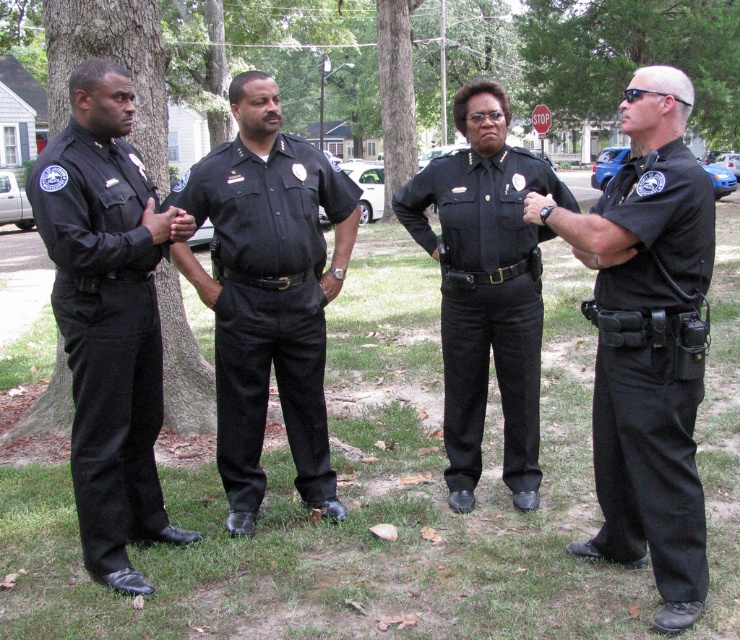
Question: Does matte black uniform at left come in front of brown textured tree trunk at left?

Choices:
 (A) no
 (B) yes

Answer: (B)

Question: Which of the following is the farthest from the observer?

Choices:
 (A) brown textured tree trunk at left
 (B) green leafy tree at upper center
 (C) green textured tree at center

Answer: (B)

Question: Is black matte uniform at right thinner than matte black uniform at left?

Choices:
 (A) yes
 (B) no

Answer: (A)

Question: Based on their relative distances, which object is nearer to the matte black uniform at left?

Choices:
 (A) black matte uniform at center
 (B) black smooth uniform at center
 (C) green textured tree at center

Answer: (B)

Question: Which of the following is the closest to the observer?

Choices:
 (A) (574, 208)
 (B) (655, 493)
 (C) (97, 513)

Answer: (B)

Question: Does black matte uniform at right have a larger size compared to green textured tree at center?

Choices:
 (A) no
 (B) yes

Answer: (A)